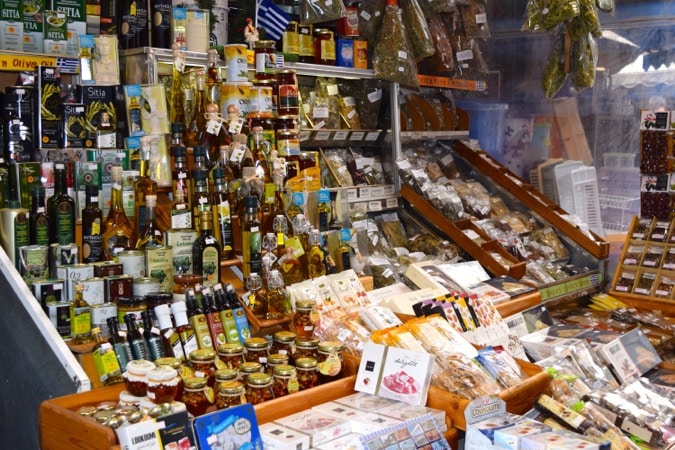
The height and width of the screenshot is (450, 675). I want to click on sauce bottles, so click(113, 347), click(124, 343), click(136, 343), click(150, 342), click(177, 346), click(187, 339), click(205, 331), click(215, 327), click(225, 325), click(240, 322).